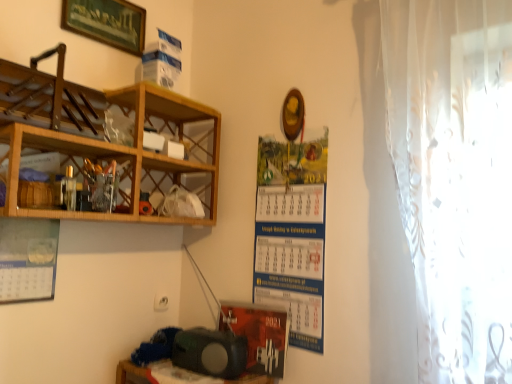
Question: Is matte black speaker at lower center further to camera compared to matte black speaker at lower center?

Choices:
 (A) no
 (B) yes

Answer: (B)

Question: Would you say matte black speaker at lower center is outside matte black speaker at lower center?

Choices:
 (A) yes
 (B) no

Answer: (A)

Question: Does matte black speaker at lower center appear on the left side of matte black speaker at lower center?

Choices:
 (A) no
 (B) yes

Answer: (A)

Question: Can you confirm if matte black speaker at lower center is shorter than matte black speaker at lower center?

Choices:
 (A) no
 (B) yes

Answer: (A)

Question: Is matte black speaker at lower center surrounding matte black speaker at lower center?

Choices:
 (A) yes
 (B) no

Answer: (B)

Question: In terms of height, does wooden at left, the first shelf in the top-to-bottom sequence, look taller or shorter compared to matte black speaker at lower center?

Choices:
 (A) tall
 (B) short

Answer: (A)

Question: In terms of width, does wooden at left, placed as the second shelf when sorted from bottom to top, look wider or thinner when compared to matte black speaker at lower center?

Choices:
 (A) wide
 (B) thin

Answer: (A)

Question: Which is correct: wooden at left, placed as the second shelf when sorted from bottom to top, is inside matte black speaker at lower center, or outside of it?

Choices:
 (A) inside
 (B) outside

Answer: (B)

Question: Considering their positions, is wooden at left, the first shelf in the top-to-bottom sequence, located in front of or behind matte black speaker at lower center?

Choices:
 (A) behind
 (B) front

Answer: (B)

Question: From their relative heights in the image, would you say matte black speaker at lower center is taller or shorter than wooden at left, the 2th shelf positioned from the top?

Choices:
 (A) short
 (B) tall

Answer: (A)

Question: Considering the positions of matte black speaker at lower center and wooden at left, the 1th shelf ordered from the bottom, in the image, is matte black speaker at lower center wider or thinner than wooden at left, the 1th shelf ordered from the bottom,?

Choices:
 (A) wide
 (B) thin

Answer: (A)

Question: Based on their sizes in the image, would you say matte black speaker at lower center is bigger or smaller than wooden at left, the 2th shelf positioned from the top?

Choices:
 (A) small
 (B) big

Answer: (A)

Question: From the image's perspective, is matte black speaker at lower center above or below wooden at left, the 1th shelf ordered from the bottom?

Choices:
 (A) below
 (B) above

Answer: (A)

Question: Looking at the image, does matte black speaker at lower center seem bigger or smaller compared to matte paper calendar at center?

Choices:
 (A) big
 (B) small

Answer: (B)

Question: Is matte black speaker at lower center inside the boundaries of matte paper calendar at center, or outside?

Choices:
 (A) outside
 (B) inside

Answer: (A)